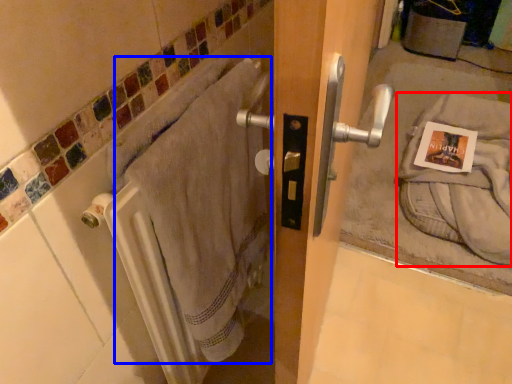
Question: Which of the following is the farthest to the observer, bath towel (highlighted by a red box) or bath towel (highlighted by a blue box)?

Choices:
 (A) bath towel
 (B) bath towel

Answer: (A)